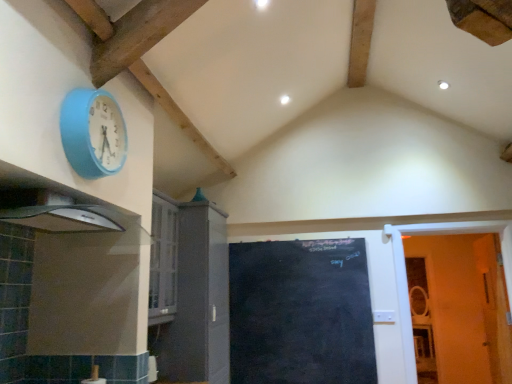
Question: Considering the relative positions of white wooden door at right, which is the 1th door from right to left, and black chalkboard at center, positioned as the second door in right-to-left order, in the image provided, is white wooden door at right, which is the 1th door from right to left, behind black chalkboard at center, positioned as the second door in right-to-left order,?

Choices:
 (A) no
 (B) yes

Answer: (A)

Question: Is white wooden door at right, which is the 1th door from right to left, closer to the viewer compared to black chalkboard at center, positioned as the second door in right-to-left order?

Choices:
 (A) no
 (B) yes

Answer: (B)

Question: From the image's perspective, is white wooden door at right, which is the 1th door from right to left, located above black chalkboard at center, the 1th door from the left?

Choices:
 (A) no
 (B) yes

Answer: (B)

Question: Does white wooden door at right, which is the 1th door from right to left, have a lesser height compared to black chalkboard at center, positioned as the second door in right-to-left order?

Choices:
 (A) yes
 (B) no

Answer: (B)

Question: Considering the relative positions of white wooden door at right, acting as the second door starting from the left, and black chalkboard at center, positioned as the second door in right-to-left order, in the image provided, is white wooden door at right, acting as the second door starting from the left, to the left of black chalkboard at center, positioned as the second door in right-to-left order, from the viewer's perspective?

Choices:
 (A) no
 (B) yes

Answer: (A)

Question: Considering the positions of blue rubber wall clock at upper left and black chalkboard at center, positioned as the second door in right-to-left order, in the image, is blue rubber wall clock at upper left wider or thinner than black chalkboard at center, positioned as the second door in right-to-left order,?

Choices:
 (A) wide
 (B) thin

Answer: (A)

Question: From a real-world perspective, is blue rubber wall clock at upper left above or below black chalkboard at center, positioned as the second door in right-to-left order?

Choices:
 (A) above
 (B) below

Answer: (A)

Question: In terms of height, does blue rubber wall clock at upper left look taller or shorter compared to black chalkboard at center, positioned as the second door in right-to-left order?

Choices:
 (A) tall
 (B) short

Answer: (B)

Question: Considering the positions of point (x=76, y=130) and point (x=295, y=289), is point (x=76, y=130) closer or farther from the camera than point (x=295, y=289)?

Choices:
 (A) closer
 (B) farther

Answer: (A)

Question: From their relative heights in the image, would you say matte gray cabinet at center-left is taller or shorter than white wooden door at right, acting as the second door starting from the left?

Choices:
 (A) short
 (B) tall

Answer: (B)

Question: From a real-world perspective, relative to white wooden door at right, which is the 1th door from right to left, is matte gray cabinet at center-left vertically above or below?

Choices:
 (A) below
 (B) above

Answer: (B)

Question: From the image's perspective, is matte gray cabinet at center-left positioned above or below white wooden door at right, which is the 1th door from right to left?

Choices:
 (A) below
 (B) above

Answer: (B)

Question: Considering the relative positions of matte gray cabinet at center-left and white wooden door at right, acting as the second door starting from the left, in the image provided, is matte gray cabinet at center-left to the left or to the right of white wooden door at right, acting as the second door starting from the left,?

Choices:
 (A) right
 (B) left

Answer: (B)

Question: Is white wooden door at right, acting as the second door starting from the left, inside or outside of black chalkboard at center, the 1th door from the left?

Choices:
 (A) inside
 (B) outside

Answer: (B)

Question: In the image, is white wooden door at right, which is the 1th door from right to left, positioned in front of or behind black chalkboard at center, the 1th door from the left?

Choices:
 (A) behind
 (B) front

Answer: (B)